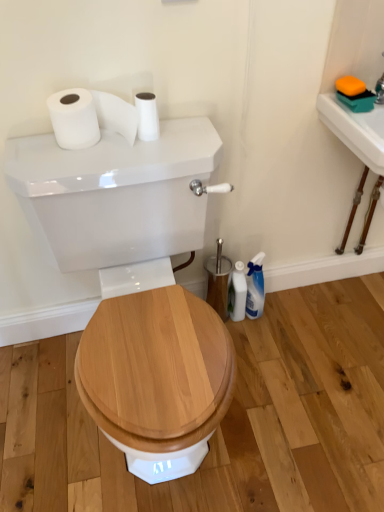
Measure the distance between white matte toilet paper at upper left, which appears as the first toilet paper when viewed from the left, and camera.

The depth of white matte toilet paper at upper left, which appears as the first toilet paper when viewed from the left, is 38.07 inches.

Measure the distance between point (125, 336) and camera.

The distance of point (125, 336) from camera is 1.01 meters.

Measure the distance between point (142, 102) and camera.

The depth of point (142, 102) is 39.33 inches.

Describe the element at coordinates (147, 116) in the screenshot. I see `white matte toilet paper at upper center, the first toilet paper positioned from the right` at that location.

What do you see at coordinates (357, 138) in the screenshot? The image size is (384, 512). I see `white glossy sink at upper right` at bounding box center [357, 138].

This screenshot has height=512, width=384. What are the coordinates of `white matte toilet paper at upper left, which is the 2th toilet paper from right to left` in the screenshot? It's located at (90, 117).

From a real-world perspective, is white matte toilet paper at upper left, which appears as the first toilet paper when viewed from the left, on white glossy toilet tank at center?

Yes, from a real-world perspective, white matte toilet paper at upper left, which appears as the first toilet paper when viewed from the left, is over white glossy toilet tank at center

Can you confirm if white matte toilet paper at upper left, which is the 2th toilet paper from right to left, is positioned to the right of white glossy toilet tank at center?

Incorrect, white matte toilet paper at upper left, which is the 2th toilet paper from right to left, is not on the right side of white glossy toilet tank at center.

From the image's perspective, is white matte toilet paper at upper left, which is the 2th toilet paper from right to left, positioned above or below white glossy toilet tank at center?

white matte toilet paper at upper left, which is the 2th toilet paper from right to left, is situated higher than white glossy toilet tank at center in the image.

Is white matte toilet paper at upper left, which is the 2th toilet paper from right to left, taller or shorter than white glossy toilet tank at center?

white matte toilet paper at upper left, which is the 2th toilet paper from right to left, is shorter than white glossy toilet tank at center.

Does white glossy sink at upper right have a greater width compared to white glossy toilet brush at lower right?

In fact, white glossy sink at upper right might be narrower than white glossy toilet brush at lower right.

From the image's perspective, would you say white glossy sink at upper right is positioned over white glossy toilet brush at lower right?

Correct, white glossy sink at upper right appears higher than white glossy toilet brush at lower right in the image.

From a real-world perspective, which is physically above, white glossy sink at upper right or white glossy toilet brush at lower right?

white glossy sink at upper right is physically above.

How different are the orientations of white glossy sink at upper right and white glossy toilet brush at lower right in degrees?

88 degrees separate the facing orientations of white glossy sink at upper right and white glossy toilet brush at lower right.

Considering the relative sizes of white matte toilet paper at upper center, which is counted as the second toilet paper, starting from the left, and white glossy sink at upper right in the image provided, is white matte toilet paper at upper center, which is counted as the second toilet paper, starting from the left, smaller than white glossy sink at upper right?

No, white matte toilet paper at upper center, which is counted as the second toilet paper, starting from the left, is not smaller than white glossy sink at upper right.

Is white matte toilet paper at upper center, which is counted as the second toilet paper, starting from the left, taller than white glossy sink at upper right?

No.

From a real-world perspective, who is located higher, white matte toilet paper at upper center, the first toilet paper positioned from the right, or white glossy sink at upper right?

From a 3D spatial view, white matte toilet paper at upper center, the first toilet paper positioned from the right, is above.

Is white glossy toilet brush at lower right situated inside white glossy toilet tank at center or outside?

white glossy toilet brush at lower right cannot be found inside white glossy toilet tank at center.

Can you confirm if white glossy toilet brush at lower right is bigger than white glossy toilet tank at center?

No, white glossy toilet brush at lower right is not bigger than white glossy toilet tank at center.

From a real-world perspective, is white glossy toilet brush at lower right physically located above or below white glossy toilet tank at center?

In terms of real-world spatial position, white glossy toilet brush at lower right is below white glossy toilet tank at center.

Which is nearer, (239, 275) or (17, 151)?

Clearly, point (239, 275) is more distant from the camera than point (17, 151).

Is white glossy toilet tank at center aimed at white matte toilet paper at upper left, which appears as the first toilet paper when viewed from the left?

No, white glossy toilet tank at center is not facing towards white matte toilet paper at upper left, which appears as the first toilet paper when viewed from the left.

Is white glossy toilet tank at center taller or shorter than white matte toilet paper at upper left, which appears as the first toilet paper when viewed from the left?

A: Considering their sizes, white glossy toilet tank at center has more height than white matte toilet paper at upper left, which appears as the first toilet paper when viewed from the left.

How different are the orientations of white glossy toilet tank at center and white matte toilet paper at upper left, which appears as the first toilet paper when viewed from the left, in degrees?

The angle between the facing direction of white glossy toilet tank at center and the facing direction of white matte toilet paper at upper left, which appears as the first toilet paper when viewed from the left, is 0.417 degrees.

Between point (199, 217) and point (79, 130), which one is positioned in front?

Positioned in front is point (79, 130).

In the scene shown: Is white glossy toilet brush at lower right in front of or behind white glossy sink at upper right in the image?

white glossy toilet brush at lower right is positioned farther from the viewer than white glossy sink at upper right.

This screenshot has width=384, height=512. I want to click on toiletry that is below the white glossy sink at upper right (from the image's perspective), so coord(237,293).

From the image's perspective, which is above, white glossy toilet brush at lower right or white glossy sink at upper right?

white glossy sink at upper right, from the image's perspective.

Considering the positions of points (239, 312) and (349, 129), is point (239, 312) farther from camera compared to point (349, 129)?

Yes.

From the image's perspective, which object appears higher, white matte toilet paper at upper center, which is counted as the second toilet paper, starting from the left, or white glossy toilet tank at center?

white matte toilet paper at upper center, which is counted as the second toilet paper, starting from the left, is shown above in the image.

Are white matte toilet paper at upper center, which is counted as the second toilet paper, starting from the left, and white glossy toilet tank at center located far from each other?

No, white matte toilet paper at upper center, which is counted as the second toilet paper, starting from the left, is in close proximity to white glossy toilet tank at center.

Is white matte toilet paper at upper center, which is counted as the second toilet paper, starting from the left, positioned behind white glossy toilet tank at center?

Yes, white matte toilet paper at upper center, which is counted as the second toilet paper, starting from the left, is further from the camera.

Is point (138, 94) positioned behind point (104, 161)?

Yes.

I want to click on porcelain located underneath the white matte toilet paper at upper left, which appears as the first toilet paper when viewed from the left (from a real-world perspective), so click(x=135, y=282).

Find the location of `sink in front of the white glossy toilet brush at lower right`. sink in front of the white glossy toilet brush at lower right is located at coordinates (357, 138).

Estimate the real-world distances between objects in this image. Which object is closer to white glossy sink at upper right, white glossy toilet brush at lower right or white glossy toilet tank at center?

white glossy toilet brush at lower right.

When comparing their distances from white matte toilet paper at upper center, which is counted as the second toilet paper, starting from the left, does white glossy sink at upper right or white glossy toilet tank at center seem further?

Based on the image, white glossy sink at upper right appears to be further to white matte toilet paper at upper center, which is counted as the second toilet paper, starting from the left.

Looking at the image, which one is located closer to white glossy sink at upper right, white glossy toilet brush at lower right or white matte toilet paper at upper center, which is counted as the second toilet paper, starting from the left?

white matte toilet paper at upper center, which is counted as the second toilet paper, starting from the left, is positioned closer to the anchor white glossy sink at upper right.

Based on their spatial positions, is white matte toilet paper at upper left, which appears as the first toilet paper when viewed from the left, or white glossy toilet brush at lower right closer to white matte toilet paper at upper center, which is counted as the second toilet paper, starting from the left?

Based on the image, white matte toilet paper at upper left, which appears as the first toilet paper when viewed from the left, appears to be nearer to white matte toilet paper at upper center, which is counted as the second toilet paper, starting from the left.

Looking at the image, which one is located further to white matte toilet paper at upper left, which appears as the first toilet paper when viewed from the left, white glossy toilet brush at lower right or white glossy toilet tank at center?

white glossy toilet brush at lower right lies further to white matte toilet paper at upper left, which appears as the first toilet paper when viewed from the left, than the other object.

Considering their positions, is white matte toilet paper at upper center, the first toilet paper positioned from the right, positioned further to white glossy sink at upper right than white glossy toilet brush at lower right?

white glossy toilet brush at lower right lies further to white glossy sink at upper right than the other object.

Consider the image. Considering their positions, is white glossy toilet tank at center positioned further to white matte toilet paper at upper left, which appears as the first toilet paper when viewed from the left, than white glossy toilet brush at lower right?

white glossy toilet brush at lower right is further to white matte toilet paper at upper left, which appears as the first toilet paper when viewed from the left.

Consider the image. Based on their spatial positions, is white matte toilet paper at upper center, the first toilet paper positioned from the right, or white glossy sink at upper right further from white glossy toilet brush at lower right?

Among the two, white matte toilet paper at upper center, the first toilet paper positioned from the right, is located further to white glossy toilet brush at lower right.

Where is `sink positioned between white glossy toilet tank at center and white glossy toilet brush at lower right from near to far`? Image resolution: width=384 pixels, height=512 pixels. sink positioned between white glossy toilet tank at center and white glossy toilet brush at lower right from near to far is located at coordinates click(357, 138).

Where is `toilet paper situated between white matte toilet paper at upper left, which is the 2th toilet paper from right to left, and white glossy sink at upper right from left to right`? This screenshot has height=512, width=384. toilet paper situated between white matte toilet paper at upper left, which is the 2th toilet paper from right to left, and white glossy sink at upper right from left to right is located at coordinates (147, 116).

Where is `toiletry between white matte toilet paper at upper left, which appears as the first toilet paper when viewed from the left, and white glossy sink at upper right`? The width and height of the screenshot is (384, 512). toiletry between white matte toilet paper at upper left, which appears as the first toilet paper when viewed from the left, and white glossy sink at upper right is located at coordinates (237, 293).

This screenshot has width=384, height=512. I want to click on toilet paper between white matte toilet paper at upper center, the first toilet paper positioned from the right, and white glossy toilet tank at center vertically, so click(90, 117).